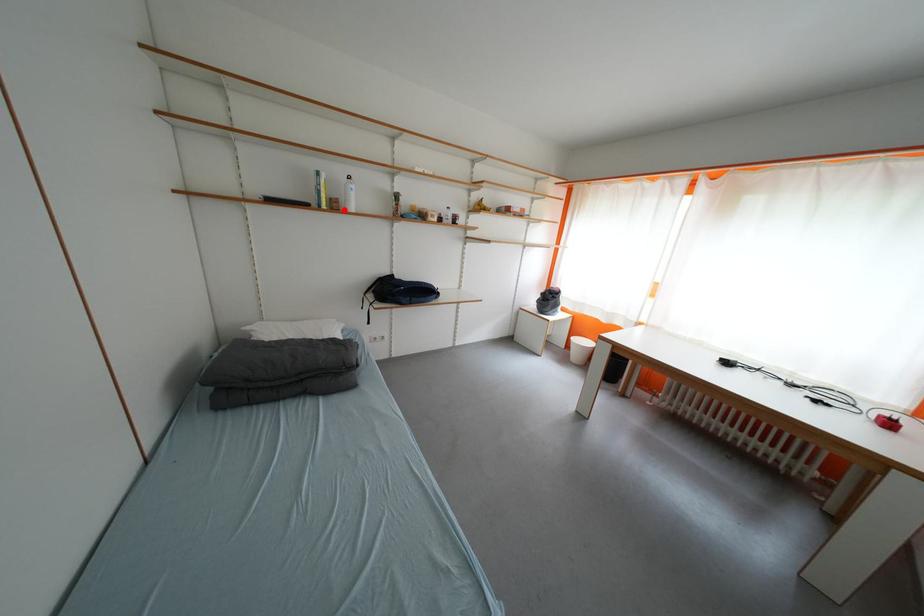
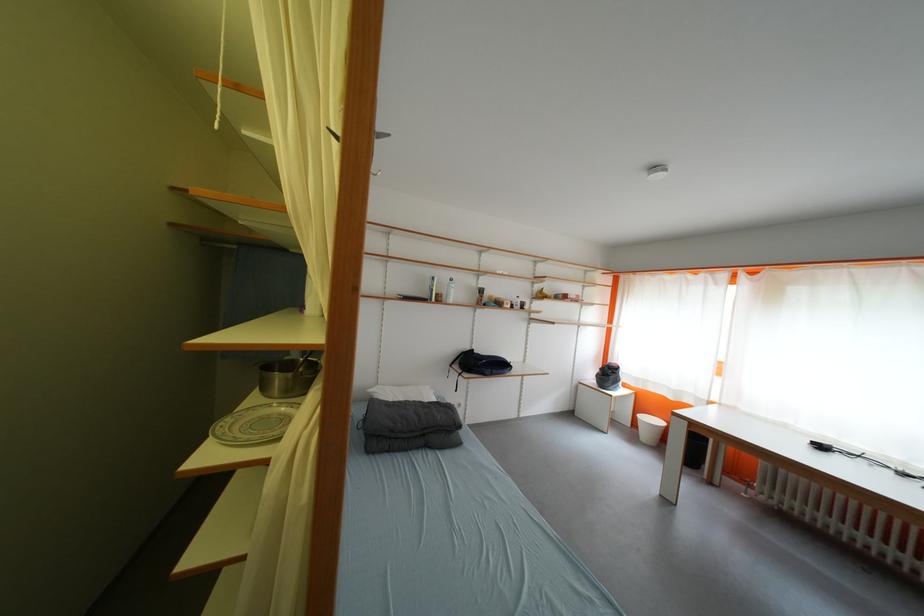
Find the pixel in the second image that matches the highlighted location in the first image.

(447, 302)